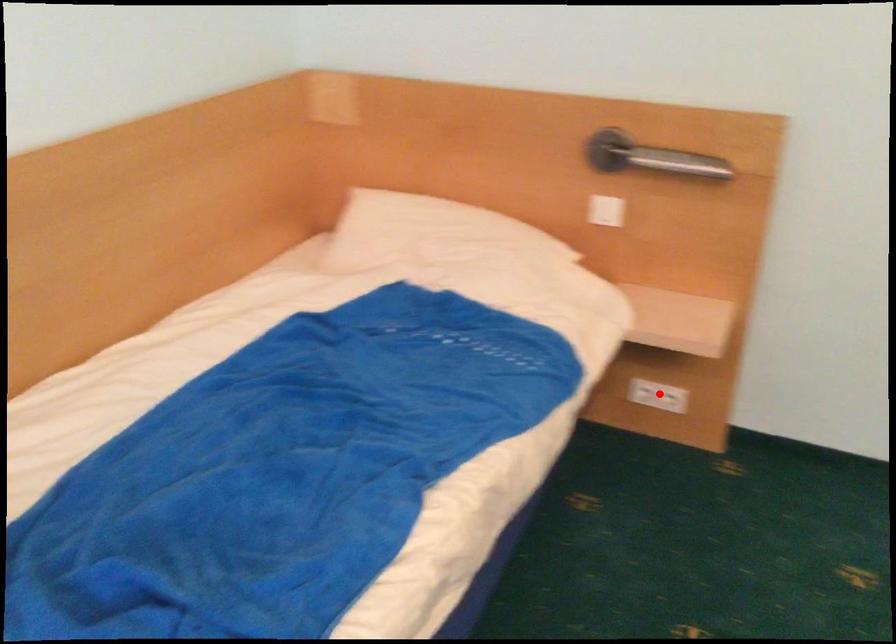
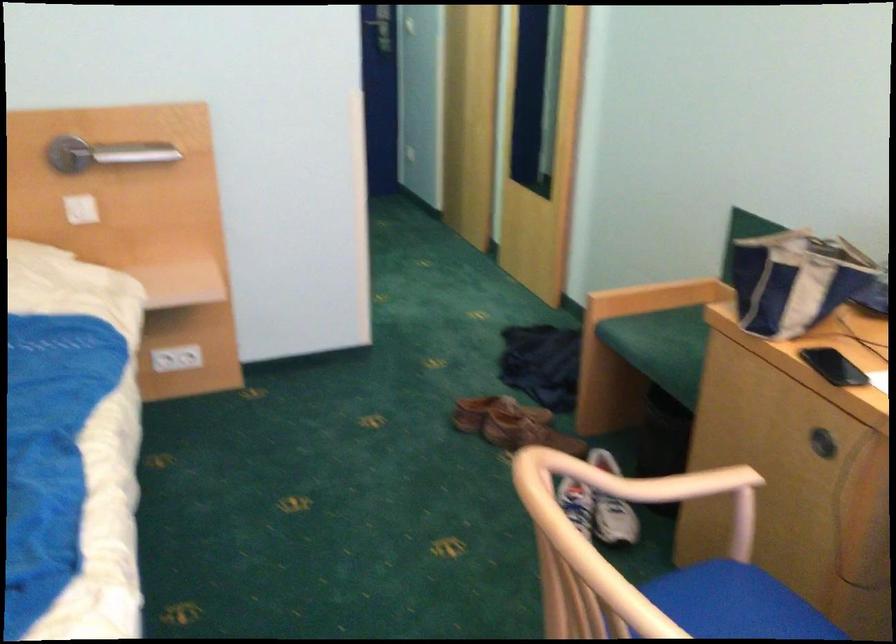
Question: I am providing you with two images of the same scene from different viewpoints. Image1 has a red point marked. In image2, the corresponding 3D location appears at what relative position? Reply with the corresponding letter.

Choices:
 (A) Closer
 (B) Farther

Answer: (B)